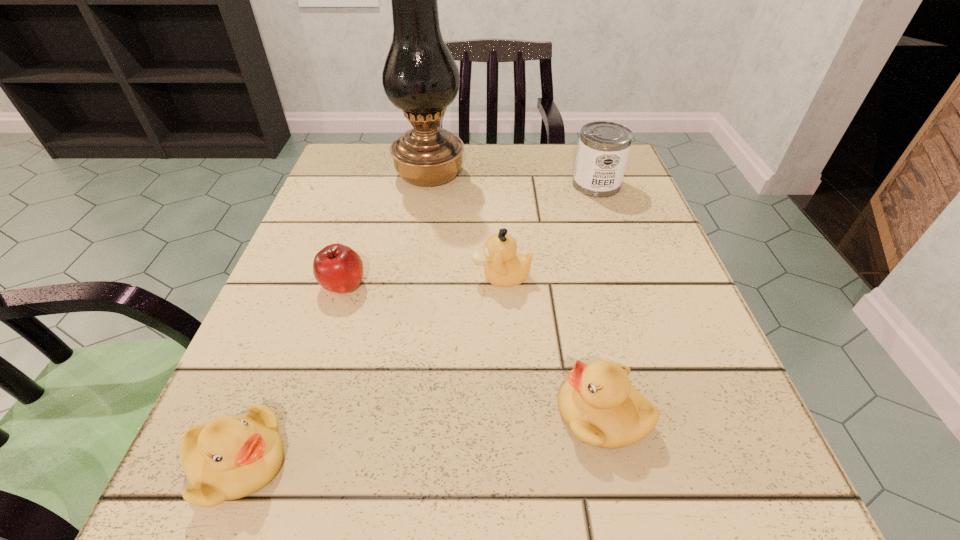
Identify the location of free spot between the leftmost duckling and the rightmost duckling. (420, 438).

I want to click on vacant point located between the apple and the rightmost duckling, so click(473, 349).

The height and width of the screenshot is (540, 960). In order to click on vacant point located between the oil lamp and the apple in this screenshot , I will do `click(387, 230)`.

Locate an element on the screen. This screenshot has height=540, width=960. object that can be found as the closest to the rightmost duckling is located at coordinates (504, 267).

The height and width of the screenshot is (540, 960). In order to click on the third closest object to the farthest duckling in this screenshot , I will do `click(420, 77)`.

Locate which duckling ranks second in proximity to the apple. Please provide its 2D coordinates. Your answer should be formatted as a tuple, i.e. [(x, y)], where the tuple contains the x and y coordinates of a point satisfying the conditions above.

[(231, 457)]

Locate which duckling ranks in proximity to the apple. Please provide its 2D coordinates. Your answer should be formatted as a tuple, i.e. [(x, y)], where the tuple contains the x and y coordinates of a point satisfying the conditions above.

[(504, 267)]

You are a GUI agent. You are given a task and a screenshot of the screen. Output one action in this format:
    pyautogui.click(x=<x>, y=<y>)
    Task: Click on the vacant space that satisfies the following two spatial constraints: 1. on the front side of the can; 2. at the face of the leftmost duckling
    The height and width of the screenshot is (540, 960).
    Given the screenshot: What is the action you would take?
    click(x=693, y=462)

Locate an element on the screen. free space that satisfies the following two spatial constraints: 1. on the front side of the can; 2. on the left side of the tallest object is located at coordinates (428, 185).